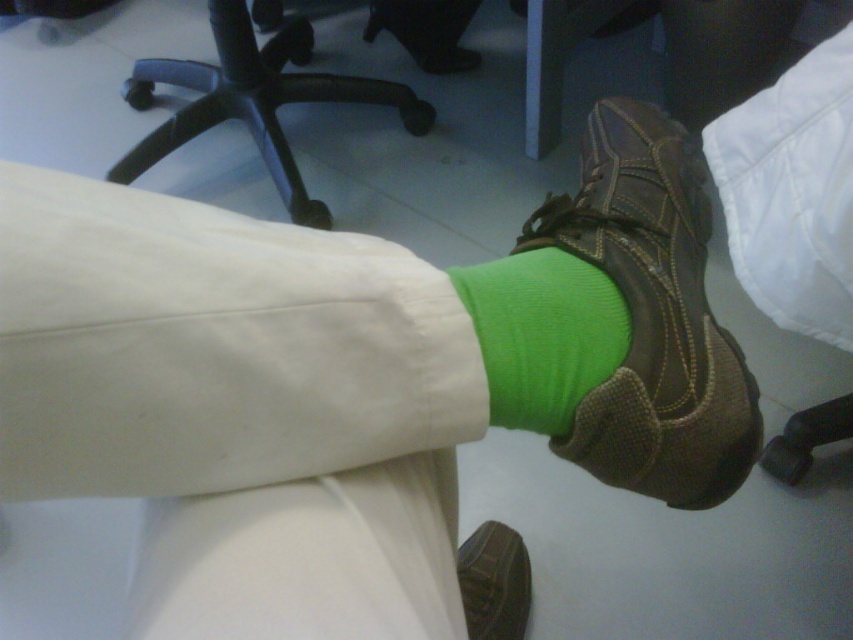
Which is in front, point (672, 193) or point (225, 6)?

Point (672, 193)

Who is lower down, brown leather shoe at center or black plastic swivel chair at upper center?

brown leather shoe at center is lower down.

Between point (692, 307) and point (228, 74), which one is positioned behind?

Point (228, 74)

You are a GUI agent. You are given a task and a screenshot of the screen. Output one action in this format:
    pyautogui.click(x=<x>, y=<y>)
    Task: Click on the brown leather shoe at center
    This screenshot has width=853, height=640.
    Given the screenshot: What is the action you would take?
    pyautogui.click(x=653, y=316)

Which of these two, green ribbed sock at center or black plastic swivel chair at upper center, stands taller?

black plastic swivel chair at upper center is taller.

I want to click on green ribbed sock at center, so click(x=543, y=333).

Is point (494, 424) farther from viewer compared to point (270, 88)?

No, it is not.

Where is `green ribbed sock at center`? This screenshot has width=853, height=640. green ribbed sock at center is located at coordinates (543, 333).

Which is more to the left, green ribbed sock at center or brown leather shoe at lower center?

Positioned to the left is green ribbed sock at center.

I want to click on green ribbed sock at center, so click(x=543, y=333).